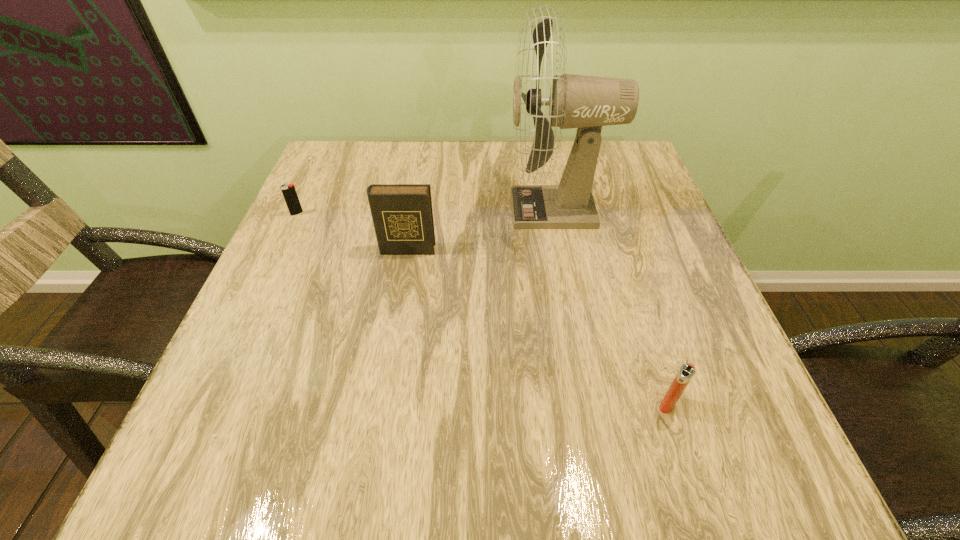
I want to click on vacant space that is in between the tallest object and the nearest object, so click(612, 307).

Identify which object is the closest to the fan. Please provide its 2D coordinates. Your answer should be formatted as a tuple, i.e. [(x, y)], where the tuple contains the x and y coordinates of a point satisfying the conditions above.

[(402, 214)]

Select which object is the third closest to the left igniter. Please provide its 2D coordinates. Your answer should be formatted as a tuple, i.e. [(x, y)], where the tuple contains the x and y coordinates of a point satisfying the conditions above.

[(686, 372)]

Where is `free space that satisfies the following two spatial constraints: 1. on the air flow direction of the nearer igniter; 2. on the left side of the fan`? free space that satisfies the following two spatial constraints: 1. on the air flow direction of the nearer igniter; 2. on the left side of the fan is located at coordinates (595, 404).

Find the location of `free spot that satisfies the following two spatial constraints: 1. on the air flow direction of the tallest object; 2. on the front cover of the diary`. free spot that satisfies the following two spatial constraints: 1. on the air flow direction of the tallest object; 2. on the front cover of the diary is located at coordinates (564, 249).

I want to click on free space in the image that satisfies the following two spatial constraints: 1. on the air flow direction of the third tallest object; 2. on the left side of the tallest object, so click(x=595, y=404).

Image resolution: width=960 pixels, height=540 pixels. I want to click on vacant area in the image that satisfies the following two spatial constraints: 1. on the front side of the nearest object; 2. on the right side of the shorter igniter, so click(x=208, y=404).

Where is `vacant position in the image that satisfies the following two spatial constraints: 1. on the air flow direction of the fan; 2. on the right side of the right igniter`? This screenshot has height=540, width=960. vacant position in the image that satisfies the following two spatial constraints: 1. on the air flow direction of the fan; 2. on the right side of the right igniter is located at coordinates (595, 404).

Image resolution: width=960 pixels, height=540 pixels. Identify the location of blank area in the image that satisfies the following two spatial constraints: 1. on the front cover of the second object from left to right; 2. on the right side of the taller igniter. (381, 404).

Find the location of a particular element. free point that satisfies the following two spatial constraints: 1. on the front side of the nearer igniter; 2. on the left side of the left igniter is located at coordinates (208, 404).